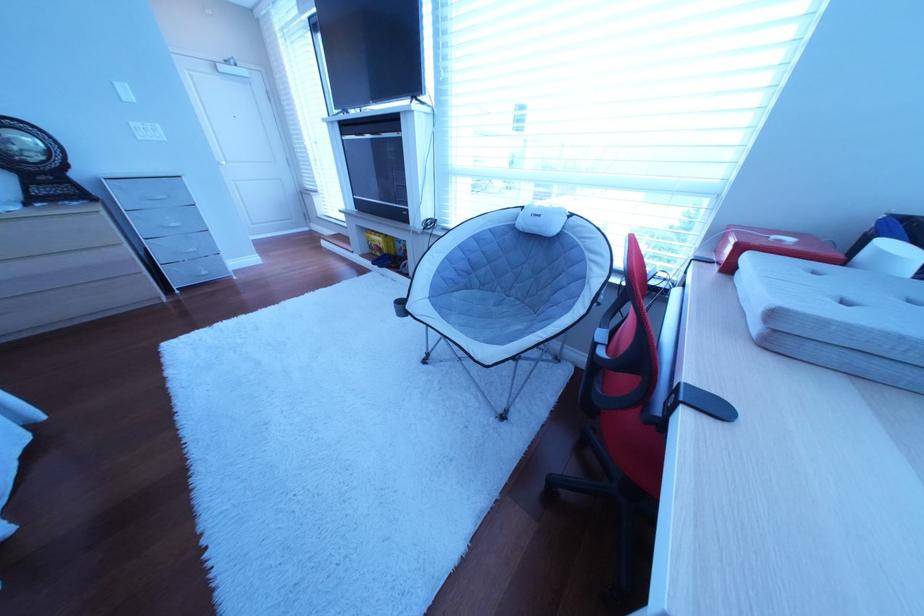
Identify the location of folded grey cushion. point(842,301).